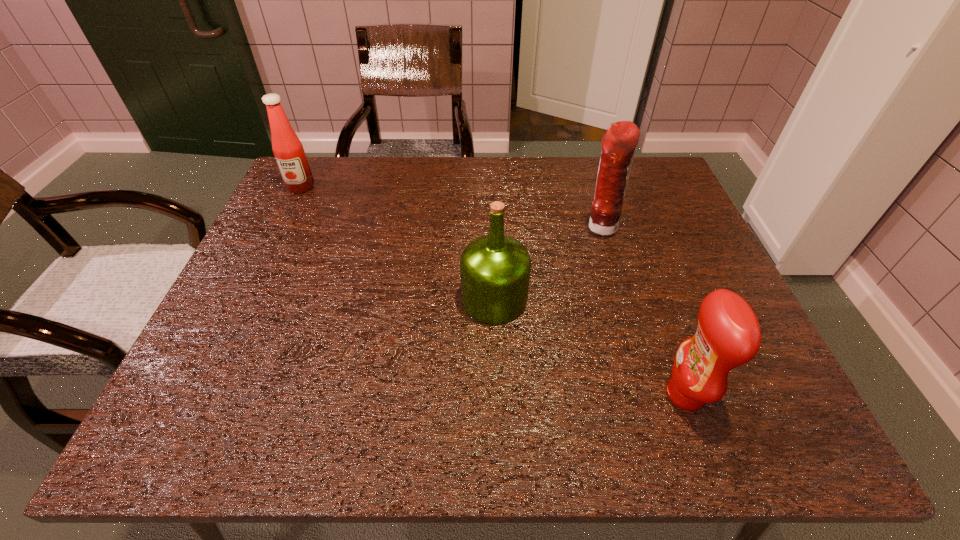
Where is `the second nearest condiment`? the second nearest condiment is located at coordinates (619, 142).

The width and height of the screenshot is (960, 540). I want to click on the farthest condiment, so click(288, 150).

At what (x,y) coordinates should I click in order to perform the action: click on the leftmost object. Please return your answer as a coordinate pair (x, y). The width and height of the screenshot is (960, 540). Looking at the image, I should click on (288, 150).

Identify the location of the third object from right to left. This screenshot has width=960, height=540. pyautogui.click(x=495, y=269).

Where is `the second nearest object`? The image size is (960, 540). the second nearest object is located at coordinates (495, 269).

This screenshot has height=540, width=960. I want to click on the nearest condiment, so click(x=728, y=335).

This screenshot has height=540, width=960. What are the coordinates of `vacant space located 0.290m on the front of the third nearest object` in the screenshot? It's located at (631, 335).

Find the location of a particular element. The image size is (960, 540). vacant space situated 0.130m on the front-facing side of the leftmost condiment is located at coordinates (283, 224).

At what (x,y) coordinates should I click in order to perform the action: click on vacant space positioned 0.320m on the left of the olive oil. Please return your answer as a coordinate pair (x, y). The width and height of the screenshot is (960, 540). Looking at the image, I should click on (318, 299).

The image size is (960, 540). What are the coordinates of `vacant point located on the label side of the nearest object` in the screenshot? It's located at (535, 394).